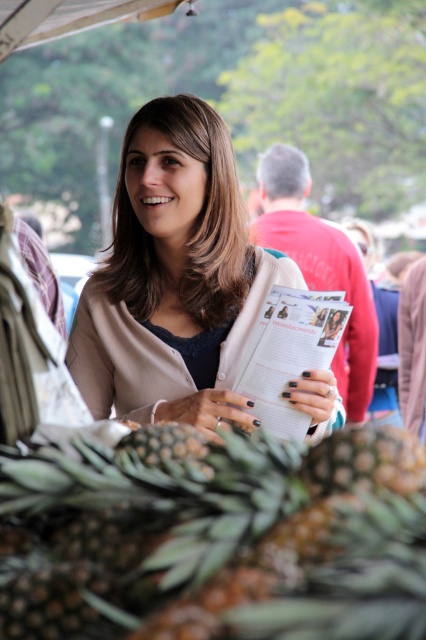
Which of these two, brown rough pineapple at lower center or light beige sweater at center, stands taller?

light beige sweater at center

Is point (209, 524) farther from camera compared to point (94, 349)?

No, (209, 524) is closer to viewer.

The image size is (426, 640). What do you see at coordinates (215, 538) in the screenshot? I see `brown rough pineapple at lower center` at bounding box center [215, 538].

The width and height of the screenshot is (426, 640). What are the coordinates of `brown rough pineapple at lower center` in the screenshot? It's located at (215, 538).

Does light beige sweater at center appear under white paper at center?

Correct, light beige sweater at center is located below white paper at center.

Does point (189, 125) lie in front of point (307, 218)?

Yes, point (189, 125) is closer to viewer.

Looking at this image, who is more forward, (192,134) or (290,237)?

Point (192,134) is in front.

At what (x,y) coordinates should I click in order to perform the action: click on light beige sweater at center. Please return your answer as a coordinate pair (x, y). Looking at the image, I should click on (173, 276).

Can you confirm if light beige sweater at center is wider than white paper magazine at center?

Indeed, light beige sweater at center has a greater width compared to white paper magazine at center.

Is point (210, 364) more distant than point (293, 291)?

Yes, point (210, 364) is farther from viewer.

Is point (154, 138) in front of point (275, 307)?

No.

You are a GUI agent. You are given a task and a screenshot of the screen. Output one action in this format:
    pyautogui.click(x=<x>, y=<y>)
    Task: Click on the light beige sweater at center
    Image resolution: width=426 pixels, height=640 pixels.
    Given the screenshot: What is the action you would take?
    pyautogui.click(x=173, y=276)